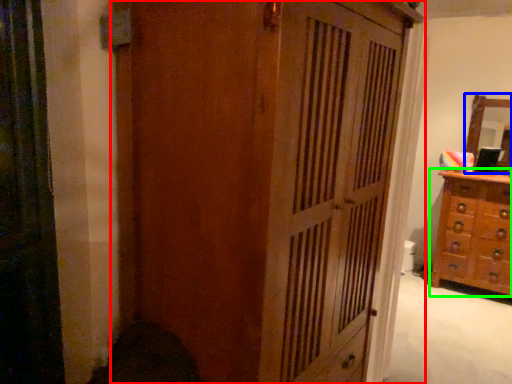
Question: Which is farther away from cupboard (highlighted by a red box)? mirror (highlighted by a blue box) or chest of drawers (highlighted by a green box)?

Choices:
 (A) mirror
 (B) chest of drawers

Answer: (A)